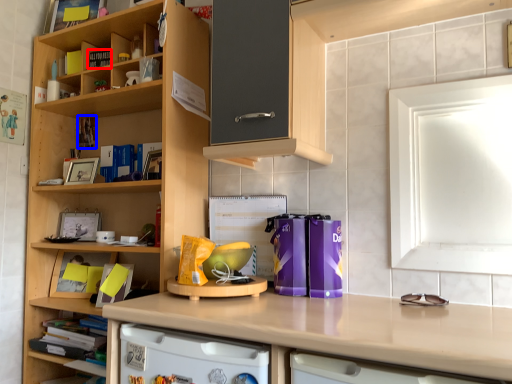
Question: Which point is further to the camera, book (highlighted by a red box) or book (highlighted by a blue box)?

Choices:
 (A) book
 (B) book

Answer: (B)